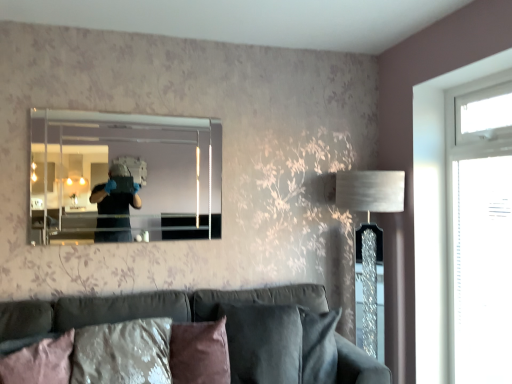
Question: Considering the relative positions of brown suede pillow at lower center, the first pillow viewed from the right, and velvet dark gray couch at lower center in the image provided, is brown suede pillow at lower center, the first pillow viewed from the right, to the left of velvet dark gray couch at lower center from the viewer's perspective?

Choices:
 (A) yes
 (B) no

Answer: (A)

Question: From the image's perspective, is brown suede pillow at lower center, the 2th pillow when ordered from left to right, beneath velvet dark gray couch at lower center?

Choices:
 (A) yes
 (B) no

Answer: (B)

Question: Is brown suede pillow at lower center, the first pillow viewed from the right, looking in the opposite direction of velvet dark gray couch at lower center?

Choices:
 (A) no
 (B) yes

Answer: (B)

Question: From the image's perspective, is brown suede pillow at lower center, the first pillow viewed from the right, on top of velvet dark gray couch at lower center?

Choices:
 (A) yes
 (B) no

Answer: (A)

Question: Is brown suede pillow at lower center, the first pillow viewed from the right, aimed at velvet dark gray couch at lower center?

Choices:
 (A) yes
 (B) no

Answer: (A)

Question: Does point (203, 213) appear closer or farther from the camera than point (485, 215)?

Choices:
 (A) farther
 (B) closer

Answer: (A)

Question: Is clear glass mirror at upper center spatially inside transparent glass door at right, or outside of it?

Choices:
 (A) inside
 (B) outside

Answer: (B)

Question: Visually, is clear glass mirror at upper center positioned to the left or to the right of transparent glass door at right?

Choices:
 (A) left
 (B) right

Answer: (A)

Question: From the image's perspective, is clear glass mirror at upper center positioned above or below transparent glass door at right?

Choices:
 (A) below
 (B) above

Answer: (B)

Question: From a real-world perspective, is transparent glass window at right physically located above or below pink fabric pillow at lower left, acting as the 1th pillow starting from the left?

Choices:
 (A) above
 (B) below

Answer: (A)

Question: In terms of width, does transparent glass window at right look wider or thinner when compared to pink fabric pillow at lower left, acting as the second pillow starting from the right?

Choices:
 (A) wide
 (B) thin

Answer: (B)

Question: Is point (437, 251) positioned closer to the camera than point (16, 362)?

Choices:
 (A) closer
 (B) farther

Answer: (B)

Question: Looking at the image, does transparent glass window at right seem bigger or smaller compared to pink fabric pillow at lower left, acting as the second pillow starting from the right?

Choices:
 (A) small
 (B) big

Answer: (B)

Question: Looking at the image, does brown suede pillow at lower center, the 2th pillow when ordered from left to right, seem bigger or smaller compared to transparent glass door at right?

Choices:
 (A) big
 (B) small

Answer: (A)

Question: Is brown suede pillow at lower center, the 2th pillow when ordered from left to right, taller or shorter than transparent glass door at right?

Choices:
 (A) tall
 (B) short

Answer: (B)